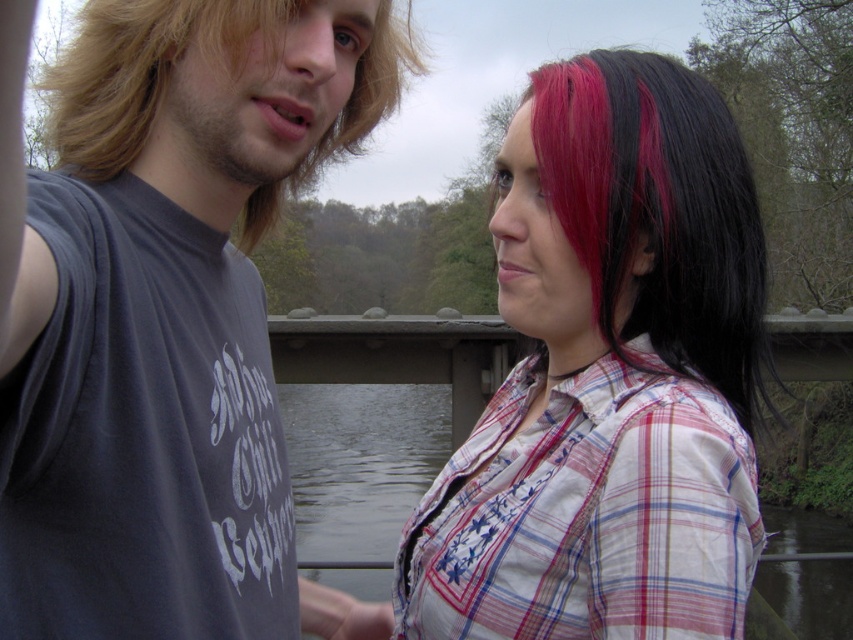
Question: Which point is closer to the camera?

Choices:
 (A) dark gray sleeveless shirt at left
 (B) blonde hair at left
 (C) plaid shirt at center

Answer: (A)

Question: Which point is farther from the camera taking this photo?

Choices:
 (A) (206, 122)
 (B) (735, 154)
 (C) (740, 284)

Answer: (C)

Question: Among these points, which one is farthest from the camera?

Choices:
 (A) (761, 323)
 (B) (401, 604)

Answer: (B)

Question: Is dark gray sleeveless shirt at left further to the viewer compared to plaid shirt at center?

Choices:
 (A) yes
 (B) no

Answer: (B)

Question: Does black shiny hair at upper right appear over blonde hair at left?

Choices:
 (A) yes
 (B) no

Answer: (B)

Question: Does dark gray sleeveless shirt at left have a greater width compared to plaid shirt at center?

Choices:
 (A) yes
 (B) no

Answer: (B)